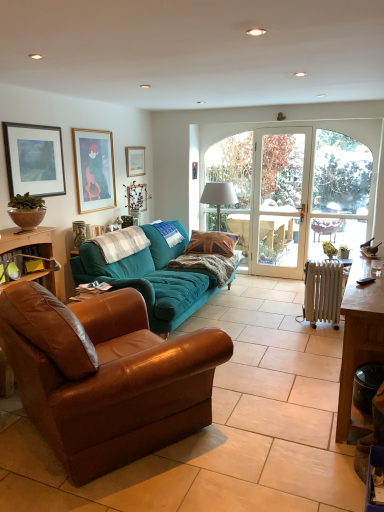
Identify the location of vacant space to the right of brown leather couch at left, arranged as the 1th studio couch when viewed from the front. (267, 417).